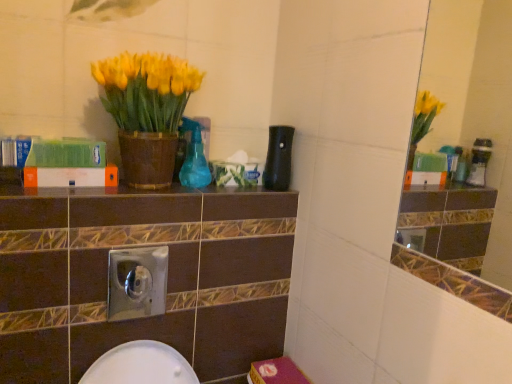
Locate an element on the screen. The image size is (512, 384). free location above green matte book at upper left, acting as the 1th book starting from the top (from a real-world perspective) is located at coordinates (42, 139).